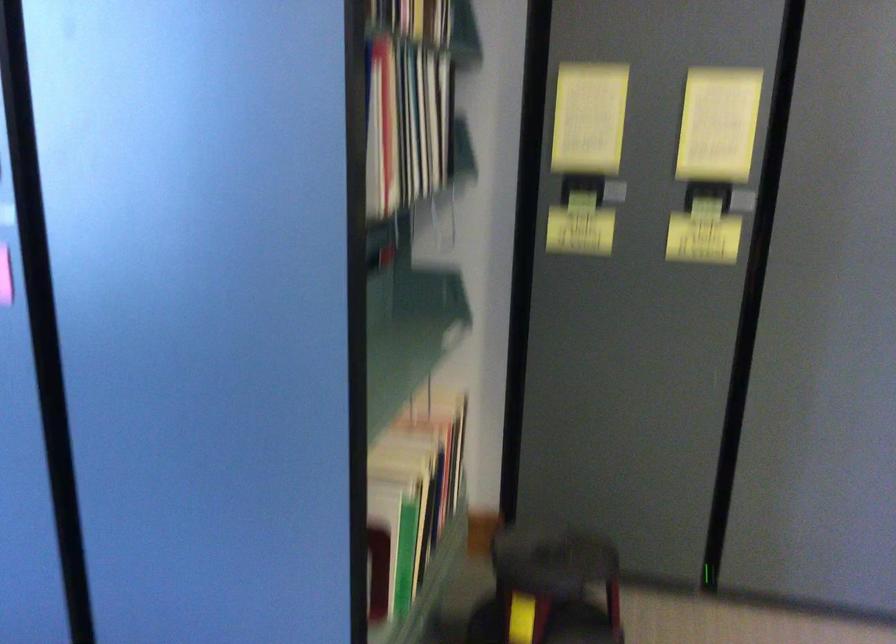
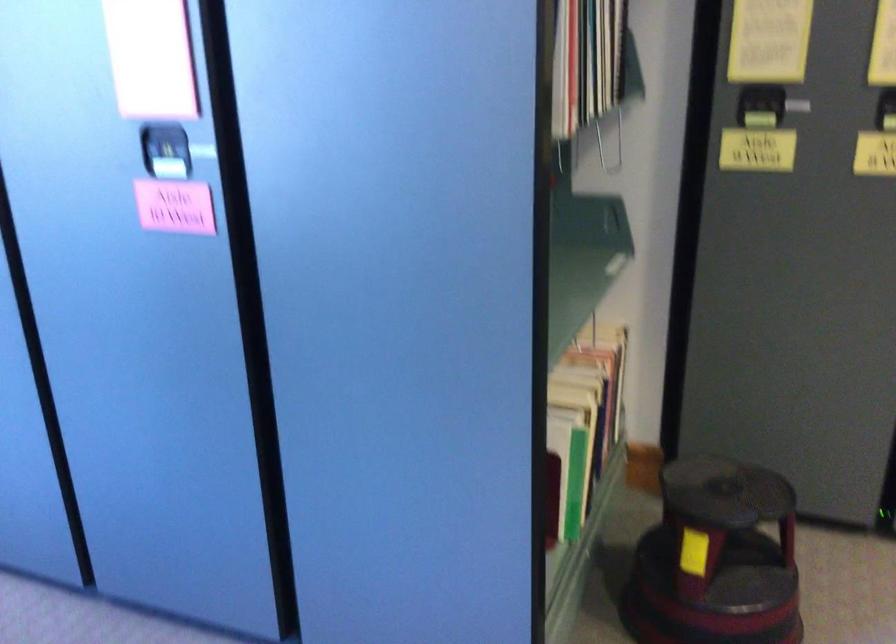
Find the pixel in the second image that matches point (552, 562) in the first image.

(725, 491)